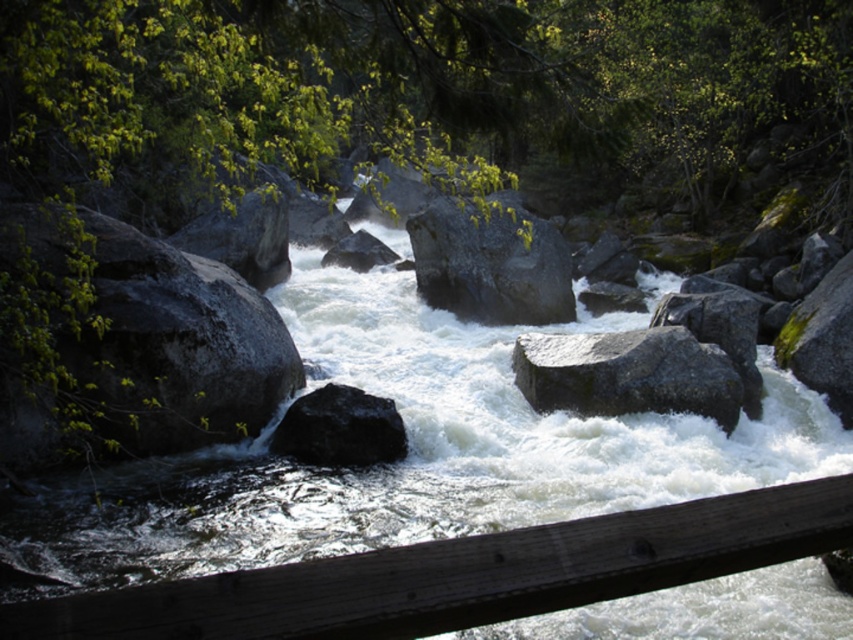
Consider the image. You are a hiker standing at the edge of the river and want to reach the smooth gray rock at center. The river is flowing rapidly with strong currents. Given that the distance from your current position to the rock is 56.23 feet, would you be able to safely cross the river to reach it?

The smooth gray rock at center is 56.23 feet away from camera. Given the strong currents and rapids in the river, it would be unsafe to attempt crossing the river to reach the rock due to the distance and hazardous conditions.

You are standing on the wooden railing and want to observe the river. Which object, the white frothy water at center or the dark gray rock at left, appears nearer to you based on their positions in the image?

The white frothy water at center appears nearer to you because it is closer to the viewer than the dark gray rock at left.